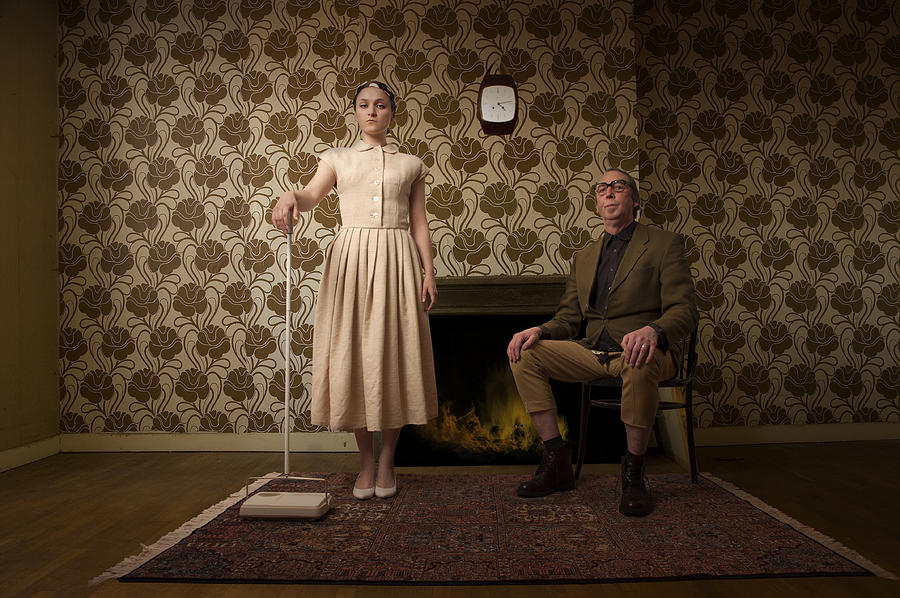
I want to click on black fireplace with fake orange fire inside, so click(470, 383), click(483, 438).